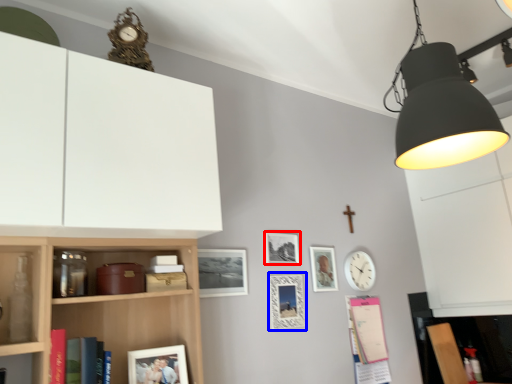
Question: Which point is further to the camera, picture frame (highlighted by a red box) or picture frame (highlighted by a blue box)?

Choices:
 (A) picture frame
 (B) picture frame

Answer: (A)